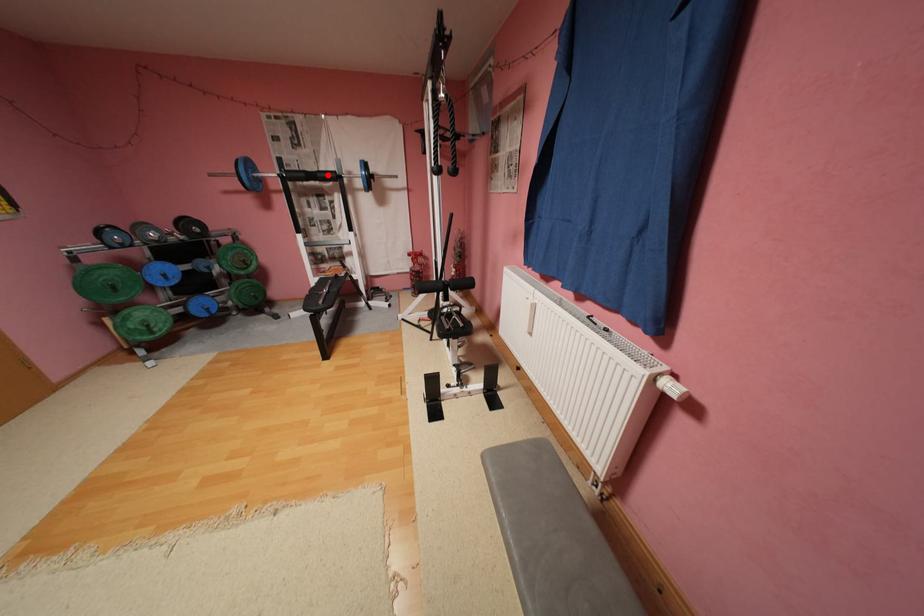
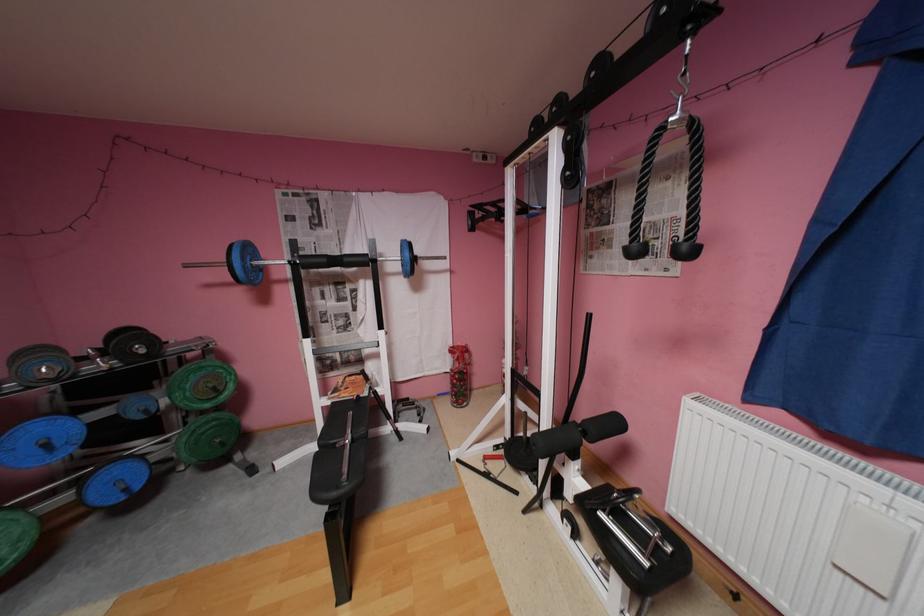
Where in the second image is the point corresponding to the highlighted location from the first image?

(355, 259)